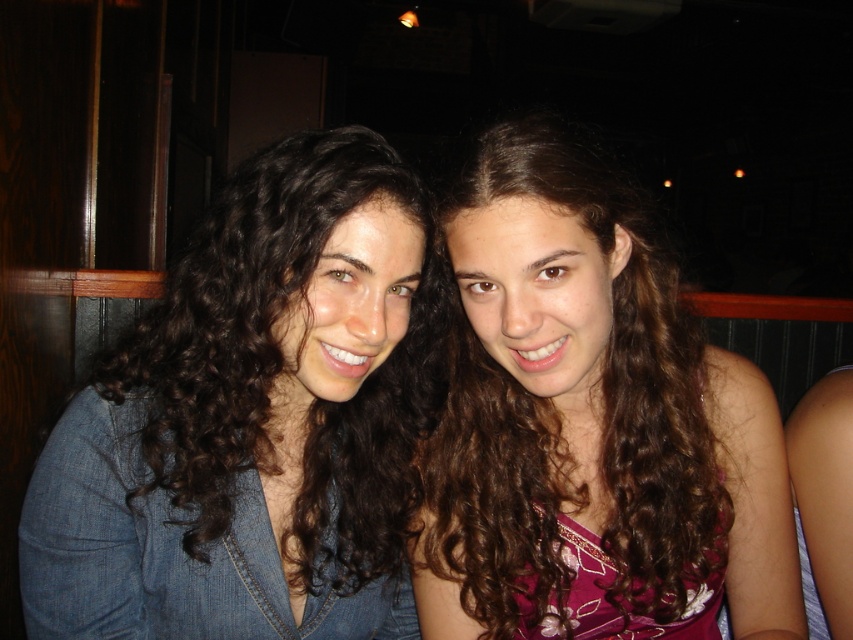
Does point (154, 392) lie in front of point (579, 284)?

No, (154, 392) is behind (579, 284).

Between point (358, 362) and point (625, 202), which one is positioned in front?

Point (358, 362)

Where is `dark brown curly hair at center`? Image resolution: width=853 pixels, height=640 pixels. dark brown curly hair at center is located at coordinates (250, 422).